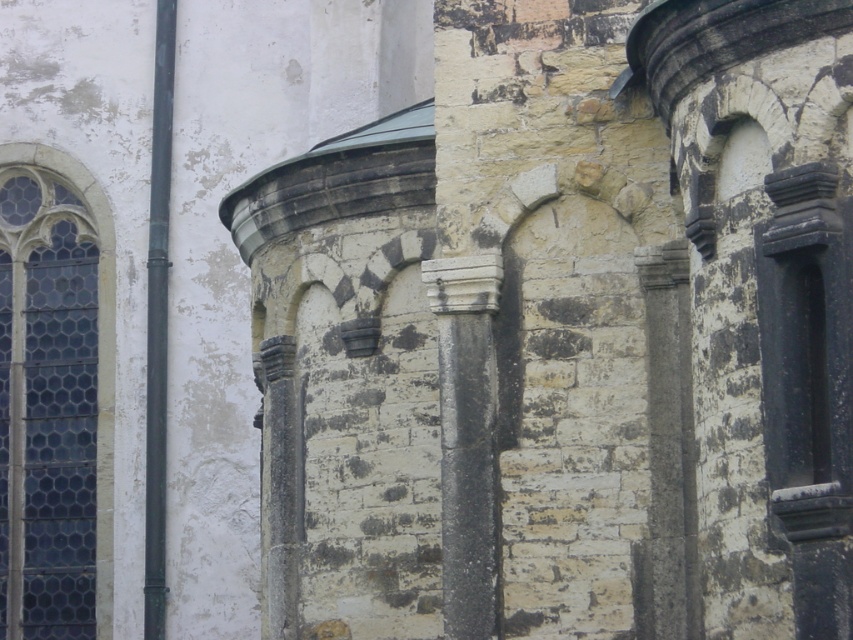
Between dark blue glass window at left and white stone column at center, which one appears on the left side from the viewer's perspective?

dark blue glass window at left

Can you confirm if dark blue glass window at left is bigger than white stone column at center?

Yes, dark blue glass window at left is bigger than white stone column at center.

I want to click on dark blue glass window at left, so (x=54, y=401).